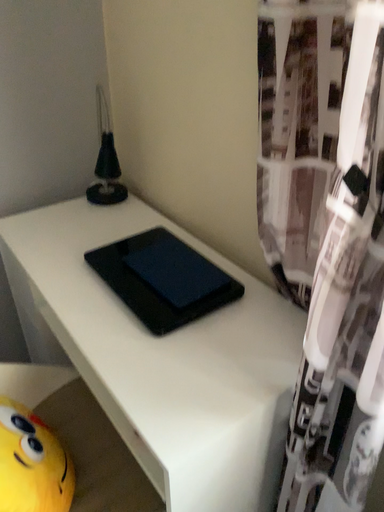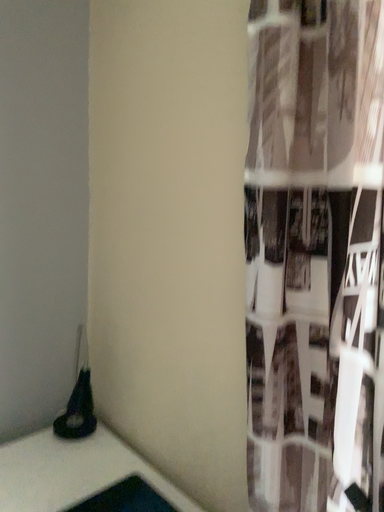
Question: Which way did the camera rotate in the video?

Choices:
 (A) rotated upward
 (B) rotated downward

Answer: (A)